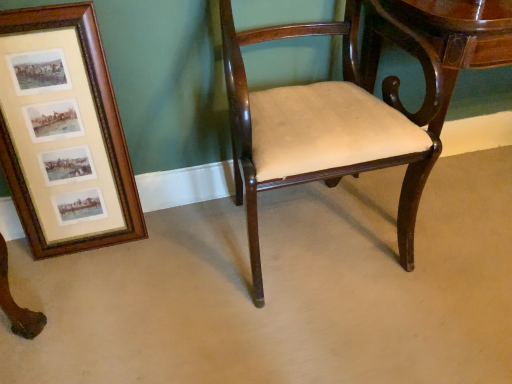
Find the location of a particular element. The image size is (512, 384). free space in front of glossy wood table at center is located at coordinates (447, 291).